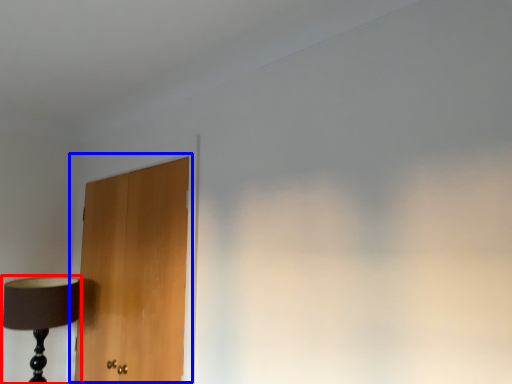
Question: Which point is further to the camera, lamp (highlighted by a red box) or door (highlighted by a blue box)?

Choices:
 (A) lamp
 (B) door

Answer: (A)